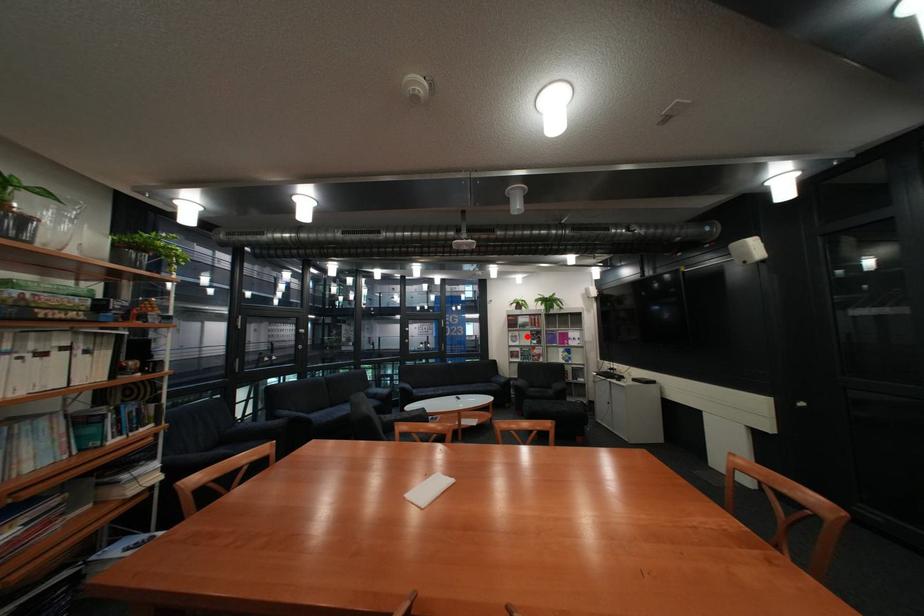
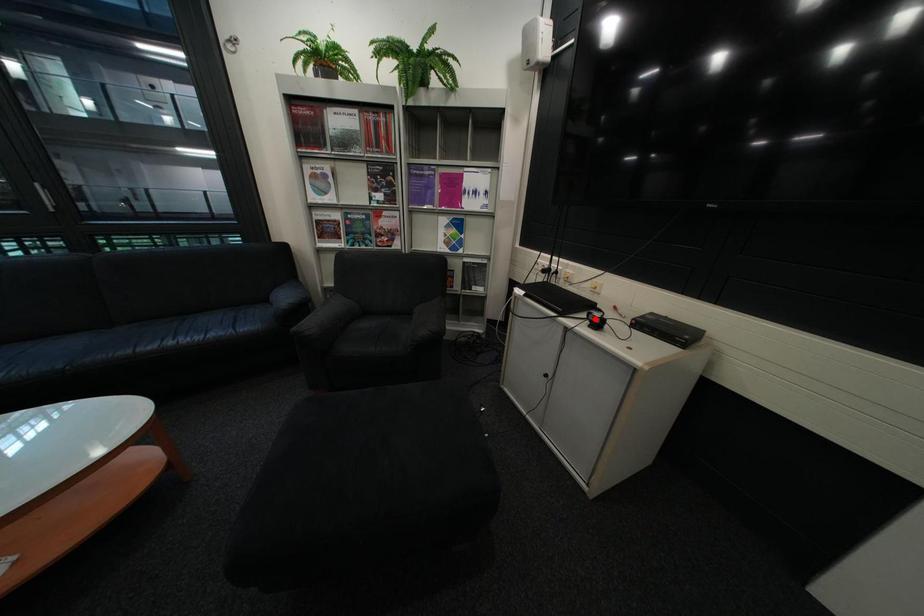
I am providing you with two images of the same scene from different viewpoints. A red point is marked on the first image and another point is marked on the second image. Does the point marked in image1 correspond to the same location as the one in image2?

No